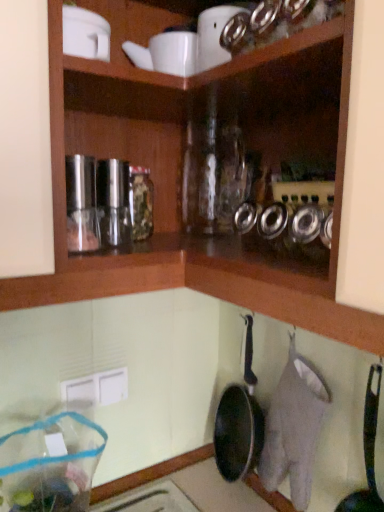
Question: From their relative heights in the image, would you say black non-stick frying pan at lower right is taller or shorter than clear plastic bag at lower left?

Choices:
 (A) tall
 (B) short

Answer: (A)

Question: Looking at their shapes, would you say black non-stick frying pan at lower right is wider or thinner than clear plastic bag at lower left?

Choices:
 (A) thin
 (B) wide

Answer: (A)

Question: From a real-world perspective, relative to clear plastic bag at lower left, is black non-stick frying pan at lower right vertically above or below?

Choices:
 (A) below
 (B) above

Answer: (B)

Question: In terms of width, does clear plastic bag at lower left look wider or thinner when compared to black non-stick frying pan at lower right?

Choices:
 (A) thin
 (B) wide

Answer: (B)

Question: Would you say clear plastic bag at lower left is to the left or to the right of black non-stick frying pan at lower right in the picture?

Choices:
 (A) right
 (B) left

Answer: (B)

Question: Is clear plastic bag at lower left spatially inside black non-stick frying pan at lower right, or outside of it?

Choices:
 (A) inside
 (B) outside

Answer: (B)

Question: Relative to black non-stick frying pan at lower right, is clear plastic bag at lower left in front or behind?

Choices:
 (A) front
 (B) behind

Answer: (B)